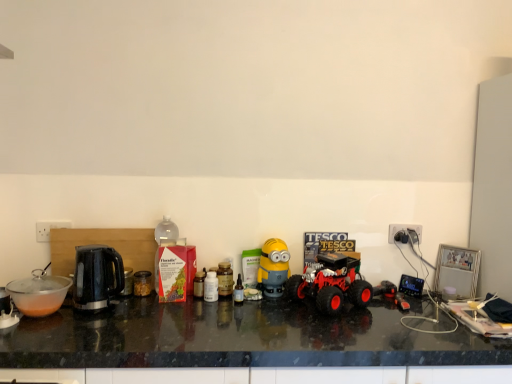
Where is `free space in front of black plastic kettle at left`? Image resolution: width=512 pixels, height=384 pixels. free space in front of black plastic kettle at left is located at coordinates (93, 325).